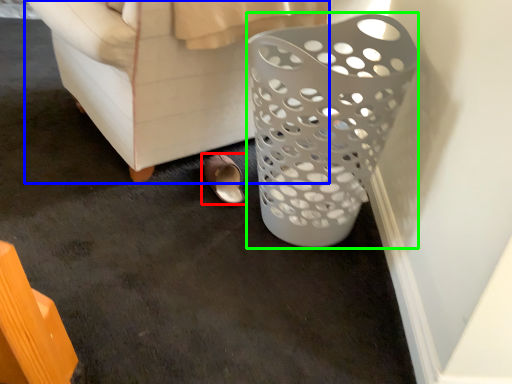
Question: Which object is positioned farthest from footwear (highlighted by a red box)? Select from furniture (highlighted by a blue box) and basket (highlighted by a green box).

Choices:
 (A) furniture
 (B) basket

Answer: (B)